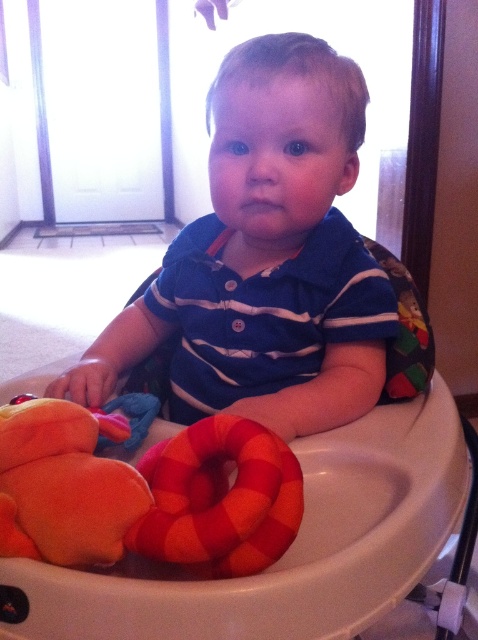
Is blue striped shirt at center below plush fabric ring at lower center?

Actually, blue striped shirt at center is above plush fabric ring at lower center.

Who is higher up, blue striped shirt at center or plush fabric ring at lower center?

blue striped shirt at center is above.

You are a GUI agent. You are given a task and a screenshot of the screen. Output one action in this format:
    pyautogui.click(x=<x>, y=<y>)
    Task: Click on the blue striped shirt at center
    
    Given the screenshot: What is the action you would take?
    pyautogui.click(x=265, y=259)

Locate an element on the screen. blue striped shirt at center is located at coordinates (265, 259).

Who is positioned more to the right, blue striped shirt at center or white plastic walker at center?

blue striped shirt at center is more to the right.

Does point (159, 314) come farther from viewer compared to point (333, 550)?

That is True.

At what (x,y) coordinates should I click in order to perform the action: click on blue striped shirt at center. Please return your answer as a coordinate pair (x, y). Image resolution: width=478 pixels, height=640 pixels. Looking at the image, I should click on (265, 259).

Is plush fabric ring at lower center to the left of soft plush toy at lower left from the viewer's perspective?

Incorrect, plush fabric ring at lower center is not on the left side of soft plush toy at lower left.

Who is taller, plush fabric ring at lower center or soft plush toy at lower left?

plush fabric ring at lower center is taller.

Is point (239, 548) positioned after point (86, 436)?

No, it is not.

Image resolution: width=478 pixels, height=640 pixels. Identify the location of plush fabric ring at lower center. (219, 499).